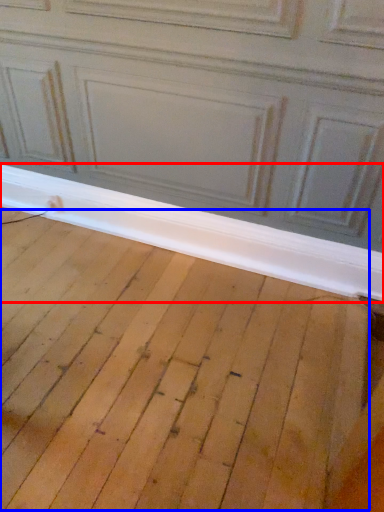
Question: Which object appears closest to the camera in this image, window sill (highlighted by a red box) or plywood (highlighted by a blue box)?

Choices:
 (A) window sill
 (B) plywood

Answer: (B)